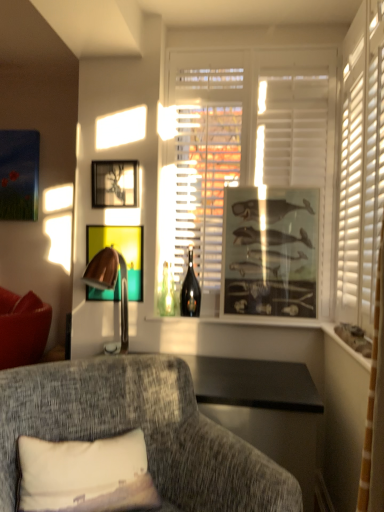
The image size is (384, 512). I want to click on metallic silver picture frame at upper center, marked as the 3th picture frame in a right-to-left arrangement, so click(114, 183).

Identify the location of white matte window at center. The height and width of the screenshot is (512, 384). (246, 145).

Where is `matte glass window sill at right, marked as the 1th window sill in a right-to-left arrangement`? This screenshot has width=384, height=512. matte glass window sill at right, marked as the 1th window sill in a right-to-left arrangement is located at coordinates (345, 345).

Describe the element at coordinates (345, 345) in the screenshot. The width and height of the screenshot is (384, 512). I see `matte glass window sill at right, placed as the second window sill when sorted from back to front` at that location.

Identify the location of matte glass picture frame at center, the 1th picture frame from the right. This screenshot has width=384, height=512. (270, 252).

Identify the location of white fabric pillow at lower left. (86, 475).

Image resolution: width=384 pixels, height=512 pixels. Describe the element at coordinates (86, 475) in the screenshot. I see `white fabric pillow at lower left` at that location.

You are a GUI agent. You are given a task and a screenshot of the screen. Output one action in this format:
    pyautogui.click(x=<x>, y=<y>)
    Task: Click on the metallic silver picture frame at upper center, marked as the 3th picture frame in a right-to-left arrangement
    The image size is (384, 512).
    Given the screenshot: What is the action you would take?
    pyautogui.click(x=114, y=183)

Would you say metallic gold picture frame at center, acting as the 2th picture frame starting from the right, is outside white matte window at center?

Yes, metallic gold picture frame at center, acting as the 2th picture frame starting from the right, is located beyond the bounds of white matte window at center.

Can you confirm if metallic gold picture frame at center, positioned as the second picture frame in left-to-right order, is smaller than white matte window at center?

Yes.

Between metallic gold picture frame at center, positioned as the second picture frame in left-to-right order, and white matte window at center, which one is positioned in front?

Positioned in front is white matte window at center.

Does metallic gold picture frame at center, acting as the 2th picture frame starting from the right, turn towards white matte window at center?

No, metallic gold picture frame at center, acting as the 2th picture frame starting from the right, is not turned towards white matte window at center.

Considering the relative sizes of copper metallic table lamp at left and matte glass picture frame at center, the 3th picture frame when ordered from left to right, in the image provided, is copper metallic table lamp at left smaller than matte glass picture frame at center, the 3th picture frame when ordered from left to right,?

Yes.

Find the location of a particular element. picture frame that is the 2nd object located above the copper metallic table lamp at left (from the image's perspective) is located at coordinates (270, 252).

Looking at this image, are copper metallic table lamp at left and matte glass picture frame at center, the 1th picture frame from the right, far apart?

No, copper metallic table lamp at left is in close proximity to matte glass picture frame at center, the 1th picture frame from the right.

Can you tell me how much white fabric pillow at lower left and white matte window at center differ in facing direction?

white fabric pillow at lower left and white matte window at center are facing 34.9 degrees away from each other.

Does point (97, 498) come farther from viewer compared to point (233, 150)?

No, (97, 498) is closer to viewer.

Is white fabric pillow at lower left oriented towards white matte window at center?

No.

Based on the photo, are white fabric pillow at lower left and textured gray couch at lower left making contact?

white fabric pillow at lower left is not next to textured gray couch at lower left, and they're not touching.

From a real-world perspective, between white fabric pillow at lower left and textured gray couch at lower left, who is vertically lower?

textured gray couch at lower left is physically lower.

You are a GUI agent. You are given a task and a screenshot of the screen. Output one action in this format:
    pyautogui.click(x=<x>, y=<y>)
    Task: Click on the pillow that is above the textured gray couch at lower left (from a real-world perspective)
    
    Given the screenshot: What is the action you would take?
    pyautogui.click(x=86, y=475)

Considering the sizes of white fabric pillow at lower left and matte glass picture frame at center, the 1th picture frame from the right, in the image, is white fabric pillow at lower left wider or thinner than matte glass picture frame at center, the 1th picture frame from the right,?

white fabric pillow at lower left is wider than matte glass picture frame at center, the 1th picture frame from the right.

From a real-world perspective, is white fabric pillow at lower left beneath matte glass picture frame at center, the 1th picture frame from the right?

Yes.

Considering the sizes of white fabric pillow at lower left and matte glass picture frame at center, the 1th picture frame from the right, in the image, is white fabric pillow at lower left taller or shorter than matte glass picture frame at center, the 1th picture frame from the right,?

white fabric pillow at lower left is shorter than matte glass picture frame at center, the 1th picture frame from the right.

Is matte glass picture frame at center, the 3th picture frame when ordered from left to right, located within white fabric pillow at lower left?

No, matte glass picture frame at center, the 3th picture frame when ordered from left to right, is not surrounded by white fabric pillow at lower left.

Consider the image. Considering the sizes of objects white fabric pillow at lower left and shiny dark glass wine bottle at center in the image provided, who is shorter, white fabric pillow at lower left or shiny dark glass wine bottle at center?

white fabric pillow at lower left.

Is white fabric pillow at lower left located outside shiny dark glass wine bottle at center?

Yes, white fabric pillow at lower left is located beyond the bounds of shiny dark glass wine bottle at center.

Is point (92, 490) positioned after point (197, 303)?

No, (92, 490) is in front of (197, 303).

Is white fabric pillow at lower left thinner than shiny dark glass wine bottle at center?

No.

Which is less distant, (183, 305) or (88, 251)?

Point (183, 305) is positioned farther from the camera compared to point (88, 251).

What's the angular difference between shiny dark glass wine bottle at center and metallic gold picture frame at center, acting as the 2th picture frame starting from the right,'s facing directions?

The angular difference between shiny dark glass wine bottle at center and metallic gold picture frame at center, acting as the 2th picture frame starting from the right, is 0.44 degrees.

Measure the distance between shiny dark glass wine bottle at center and metallic gold picture frame at center, positioned as the second picture frame in left-to-right order.

shiny dark glass wine bottle at center and metallic gold picture frame at center, positioned as the second picture frame in left-to-right order, are 13.81 inches apart.

Based on the photo, considering the relative sizes of shiny dark glass wine bottle at center and metallic gold picture frame at center, positioned as the second picture frame in left-to-right order, in the image provided, is shiny dark glass wine bottle at center wider than metallic gold picture frame at center, positioned as the second picture frame in left-to-right order,?

Yes.

From the image's perspective, count 3rd picture frames downward from the white matte window at center and point to it. Please provide its 2D coordinates.

[(120, 251)]

From a real-world perspective, which picture frame is the 2nd one above the copper metallic table lamp at left? Please provide its 2D coordinates.

[(270, 252)]

Estimate the real-world distances between objects in this image. Which object is closer to metallic gold picture frame at center, acting as the 2th picture frame starting from the right, textured gray couch at lower left or white fabric pillow at lower left?

textured gray couch at lower left lies closer to metallic gold picture frame at center, acting as the 2th picture frame starting from the right, than the other object.

Estimate the real-world distances between objects in this image. Which object is closer to white matte window at center, metallic silver picture frame at upper center, marked as the 3th picture frame in a right-to-left arrangement, or shiny dark glass wine bottle at center?

A: Based on the image, metallic silver picture frame at upper center, marked as the 3th picture frame in a right-to-left arrangement, appears to be nearer to white matte window at center.

When comparing their distances from shiny dark glass wine bottle at center, does white fabric pillow at lower left or metallic silver picture frame at upper center, marked as the 3th picture frame in a right-to-left arrangement, seem further?

white fabric pillow at lower left lies further to shiny dark glass wine bottle at center than the other object.

From the image, which object appears to be nearer to textured gray couch at lower left, white matte window at center or clear glass bottles at center, marked as the 2th window sill in a front-to-back arrangement?

clear glass bottles at center, marked as the 2th window sill in a front-to-back arrangement, is closer to textured gray couch at lower left.

From the picture: Which object lies further to the anchor point copper metallic table lamp at left, textured gray couch at lower left or metallic gold picture frame at center, acting as the 2th picture frame starting from the right?

textured gray couch at lower left is positioned further to the anchor copper metallic table lamp at left.

Estimate the real-world distances between objects in this image. Which object is closer to shiny dark glass wine bottle at center, matte glass picture frame at center, the 1th picture frame from the right, or copper metallic table lamp at left?

Among the two, matte glass picture frame at center, the 1th picture frame from the right, is located nearer to shiny dark glass wine bottle at center.

Considering their positions, is textured gray couch at lower left positioned further to clear glass bottles at center, arranged as the second window sill when viewed from the right, than shiny dark glass wine bottle at center?

textured gray couch at lower left is further to clear glass bottles at center, arranged as the second window sill when viewed from the right.

Which object lies further to the anchor point matte glass window sill at right, which is the second window sill from left to right, metallic silver picture frame at upper center, acting as the first picture frame starting from the left, or white fabric pillow at lower left?

Among the two, metallic silver picture frame at upper center, acting as the first picture frame starting from the left, is located further to matte glass window sill at right, which is the second window sill from left to right.

Locate an element on the screen. The height and width of the screenshot is (512, 384). table lamp positioned between textured gray couch at lower left and metallic silver picture frame at upper center, marked as the 3th picture frame in a right-to-left arrangement, from near to far is located at coordinates (110, 283).

The image size is (384, 512). I want to click on wine bottle between metallic gold picture frame at center, acting as the 2th picture frame starting from the right, and matte glass picture frame at center, the 1th picture frame from the right, so click(x=190, y=290).

At what (x,y) coordinates should I click in order to perform the action: click on pillow between textured gray couch at lower left and matte glass picture frame at center, the 3th picture frame when ordered from left to right, from front to back. Please return your answer as a coordinate pair (x, y). Image resolution: width=384 pixels, height=512 pixels. Looking at the image, I should click on (86, 475).

Locate an element on the screen. table lamp positioned between textured gray couch at lower left and shiny dark glass wine bottle at center from near to far is located at coordinates (110, 283).